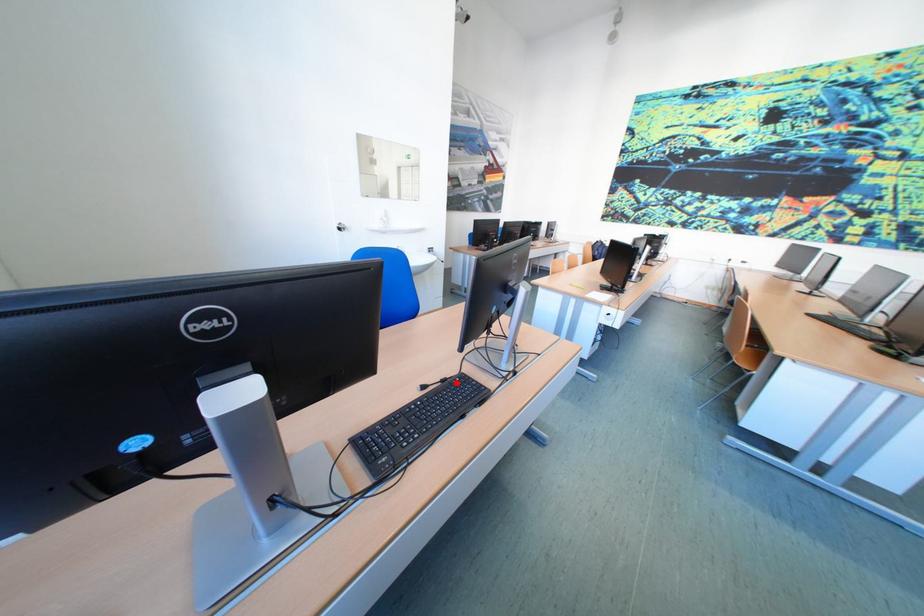
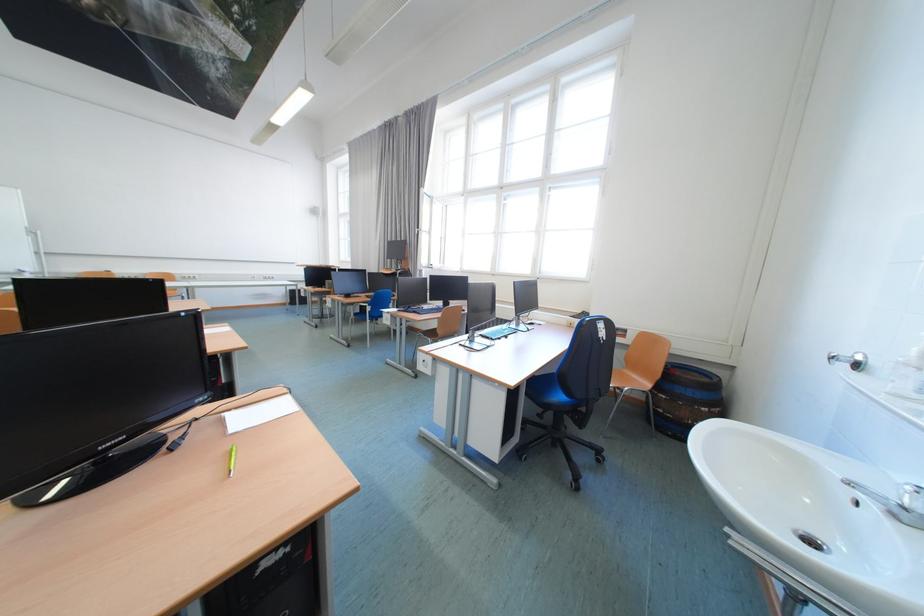
Question: I am providing you with two images of the same scene from different viewpoints. A red point is marked on the first image. Is the red point's position out of view in image 2?

Choices:
 (A) Yes
 (B) No

Answer: (A)